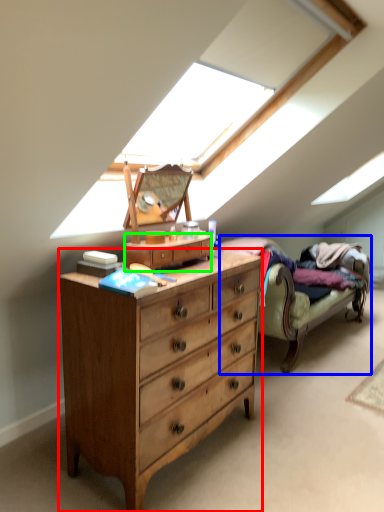
Question: Based on their relative distances, which object is nearer to chest of drawers (highlighted by a red box)? Choose from studio couch (highlighted by a blue box) and file cabinet (highlighted by a green box).

Choices:
 (A) studio couch
 (B) file cabinet

Answer: (B)